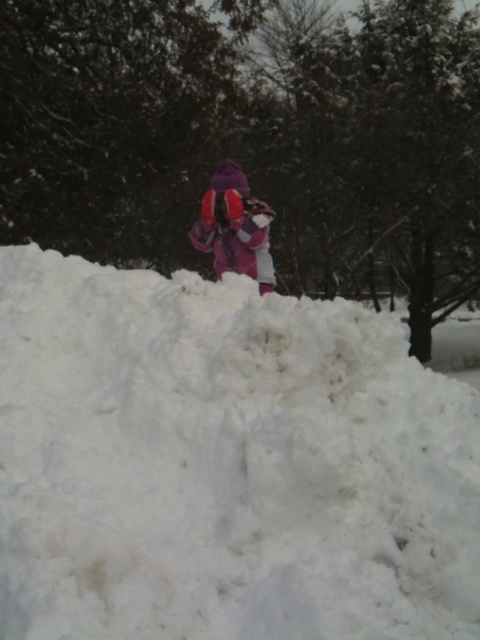
Question: Does white fluffy snow at center have a lesser width compared to purple fleece jacket at center?

Choices:
 (A) yes
 (B) no

Answer: (B)

Question: Is white fluffy snow at center closer to the viewer compared to purple fleece jacket at center?

Choices:
 (A) yes
 (B) no

Answer: (A)

Question: Which point is farther from the camera taking this photo?

Choices:
 (A) (131, 636)
 (B) (205, 195)

Answer: (B)

Question: Which point is closer to the camera?

Choices:
 (A) purple fleece jacket at center
 (B) white fluffy snow at center

Answer: (B)

Question: Does white fluffy snow at center have a smaller size compared to purple fleece jacket at center?

Choices:
 (A) yes
 (B) no

Answer: (B)